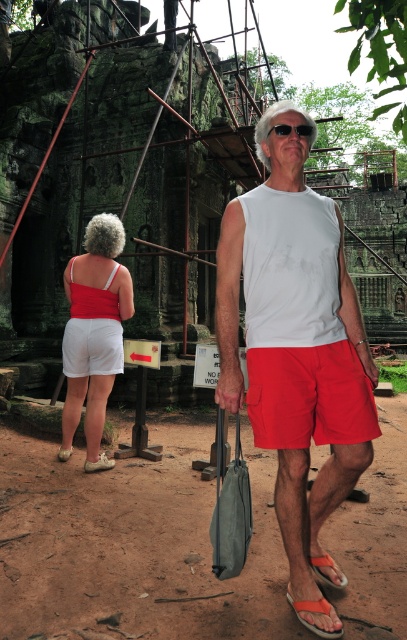
Can you confirm if brown dirt field at center is thinner than white matte tank top at center?

No.

Is brown dirt field at center positioned before white matte tank top at center?

No, it is not.

Where is `brown dirt field at center`? This screenshot has width=407, height=640. brown dirt field at center is located at coordinates (133, 545).

Who is lower down, brown dirt field at center or matte white shorts at lower left?

brown dirt field at center is below.

Consider the image. Measure the distance between brown dirt field at center and matte white shorts at lower left.

brown dirt field at center and matte white shorts at lower left are 7.42 feet apart from each other.

The width and height of the screenshot is (407, 640). What do you see at coordinates (133, 545) in the screenshot?
I see `brown dirt field at center` at bounding box center [133, 545].

Locate an element on the screen. Image resolution: width=407 pixels, height=640 pixels. brown dirt field at center is located at coordinates (133, 545).

Between matte white shorts at lower left and orange fabric sandal at lower center, which one is positioned higher?

matte white shorts at lower left is higher up.

Where is `matte white shorts at lower left`? The height and width of the screenshot is (640, 407). matte white shorts at lower left is located at coordinates (94, 333).